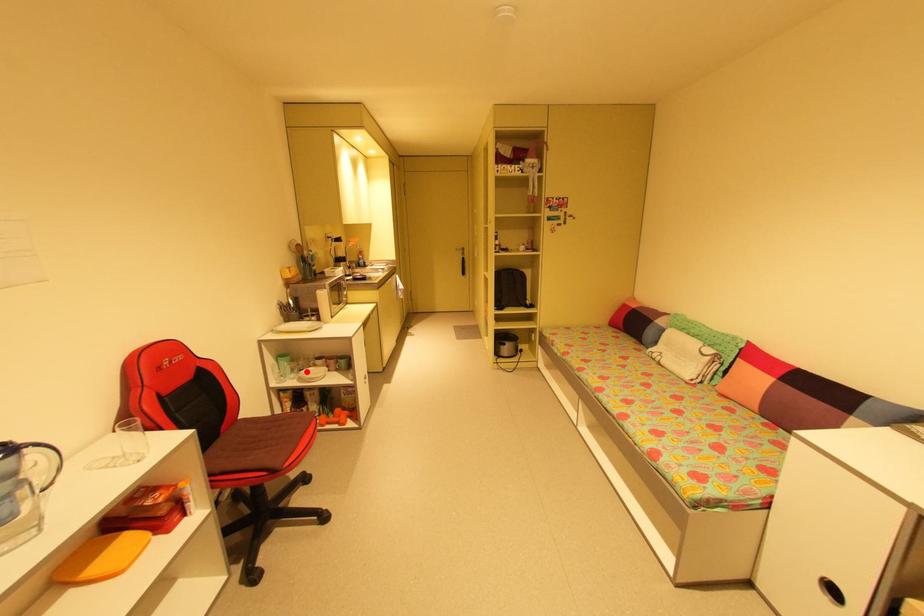
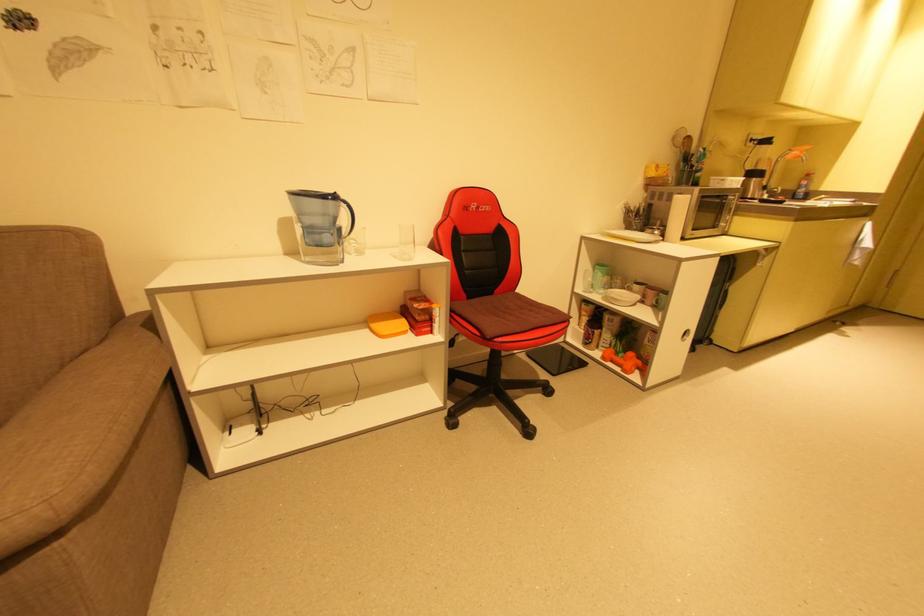
Question: A red point is marked in image1. In image2, is the corresponding 3D point closer to the camera or farther? Reply with the corresponding letter.

Choices:
 (A) The corresponding 3D point is closer.
 (B) The corresponding 3D point is farther.

Answer: (A)